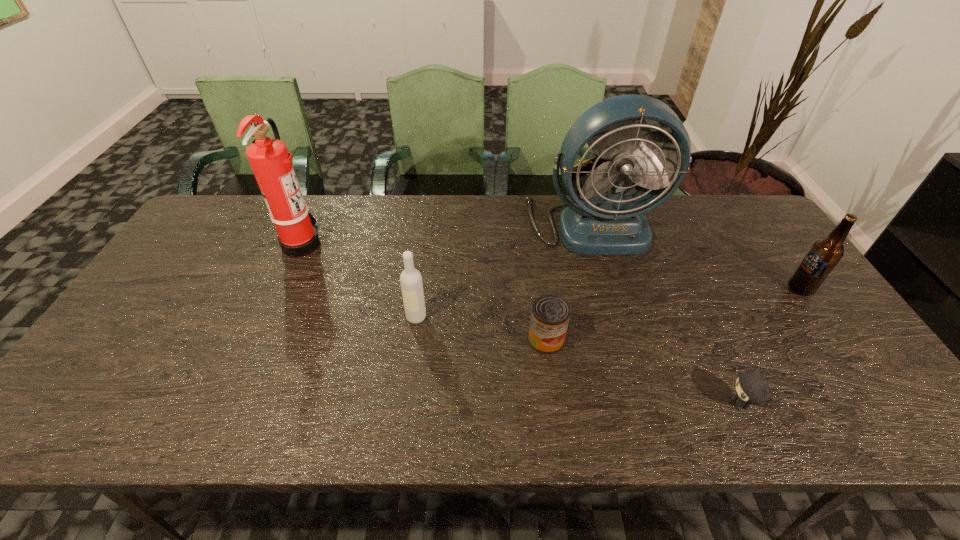
Locate an element on the screen. free space between the rightmost object and the third nearest object is located at coordinates (608, 303).

Where is `free space that is in between the leftmost object and the vodka`? free space that is in between the leftmost object and the vodka is located at coordinates (359, 280).

Locate an element on the screen. This screenshot has width=960, height=540. free space between the fourth nearest object and the leftmost object is located at coordinates (551, 266).

Identify the location of free space between the fan and the leftmost object. The height and width of the screenshot is (540, 960). (447, 234).

I want to click on free space between the rightmost object and the shortest object, so click(x=770, y=347).

You are a GUI agent. You are given a task and a screenshot of the screen. Output one action in this format:
    pyautogui.click(x=<x>, y=<y>)
    Task: Click on the vacant area that lies between the rightmost object and the leftmost object
    
    Given the screenshot: What is the action you would take?
    pyautogui.click(x=551, y=266)

Where is `unoccupied area between the can and the rightmost object`? The image size is (960, 540). unoccupied area between the can and the rightmost object is located at coordinates (673, 314).

Image resolution: width=960 pixels, height=540 pixels. In order to click on the fourth closest object to the can in this screenshot , I will do `click(270, 160)`.

In order to click on object that is the fifth closest to the can in this screenshot , I will do coord(823,256).

The image size is (960, 540). I want to click on vacant space that satisfies the following two spatial constraints: 1. in front of the fan to blow air; 2. at the nozzle of the leftmost object, so click(598, 244).